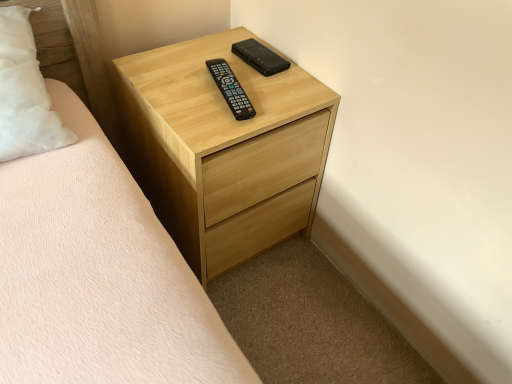
What do you see at coordinates (226, 149) in the screenshot? This screenshot has width=512, height=384. I see `light wood chest of drawers at center` at bounding box center [226, 149].

Identify the location of black plastic remote at center, placed as the second control when sorted from back to front. The image size is (512, 384). (231, 89).

Are black matte phone at upper center, the first control from the top, and light wood chest of drawers at center far apart?

No, black matte phone at upper center, the first control from the top, is not far away from light wood chest of drawers at center.

From the image's perspective, does black matte phone at upper center, the first control from the top, appear lower than light wood chest of drawers at center?

No, from the image's perspective, black matte phone at upper center, the first control from the top, is not beneath light wood chest of drawers at center.

Which is closer to the camera, (x=281, y=60) or (x=250, y=149)?

Point (x=281, y=60).

Between black plastic remote at center, the first control in the bottom-to-top sequence, and light wood chest of drawers at center, which one has more height?

light wood chest of drawers at center.

Between black plastic remote at center, the first control in the bottom-to-top sequence, and light wood chest of drawers at center, which one has smaller width?

With smaller width is black plastic remote at center, the first control in the bottom-to-top sequence.

Based on their sizes in the image, would you say black plastic remote at center, placed as the second control when sorted from back to front, is bigger or smaller than light wood chest of drawers at center?

Clearly, black plastic remote at center, placed as the second control when sorted from back to front, is smaller in size than light wood chest of drawers at center.

Is light wood chest of drawers at center closer to the viewer compared to black plastic remote at center, the 2th control positioned from the top?

Yes, the depth of light wood chest of drawers at center is less than that of black plastic remote at center, the 2th control positioned from the top.

Between light wood chest of drawers at center and black plastic remote at center, the 2th control positioned from the top, which one appears on the left side from the viewer's perspective?

From the viewer's perspective, light wood chest of drawers at center appears more on the left side.

Find the location of a particular element. Image resolution: width=512 pixels, height=384 pixels. chest of drawers on the left of black plastic remote at center, the 2th control positioned from the top is located at coordinates 226,149.

Could you tell me if light wood chest of drawers at center is turned towards black plastic remote at center, placed as the second control when sorted from back to front?

No, light wood chest of drawers at center does not turn towards black plastic remote at center, placed as the second control when sorted from back to front.

Considering the sizes of objects black plastic remote at center, the 2th control positioned from the top, and black matte phone at upper center, acting as the 1th control starting from the back, in the image provided, who is bigger, black plastic remote at center, the 2th control positioned from the top, or black matte phone at upper center, acting as the 1th control starting from the back,?

black plastic remote at center, the 2th control positioned from the top.

Are black plastic remote at center, the 2th control positioned from the top, and black matte phone at upper center, which is the 2th control in front-to-back order, making contact?

black plastic remote at center, the 2th control positioned from the top, and black matte phone at upper center, which is the 2th control in front-to-back order, are not in contact.

Would you say black plastic remote at center, the 2th control positioned from the top, is outside black matte phone at upper center, arranged as the second control when ordered from the bottom?

That's correct, black plastic remote at center, the 2th control positioned from the top, is outside of black matte phone at upper center, arranged as the second control when ordered from the bottom.

Which of these two, black plastic remote at center, the 2th control positioned from the top, or black matte phone at upper center, acting as the 1th control starting from the back, is wider?

black plastic remote at center, the 2th control positioned from the top.

Is black matte phone at upper center, the first control from the top, oriented towards black plastic remote at center, the first control from the front?

No, black matte phone at upper center, the first control from the top, is not facing towards black plastic remote at center, the first control from the front.

Is black matte phone at upper center, arranged as the second control when ordered from the bottom, to the left or to the right of black plastic remote at center, the 2th control positioned from the top, in the image?

Based on their positions, black matte phone at upper center, arranged as the second control when ordered from the bottom, is located to the right of black plastic remote at center, the 2th control positioned from the top.

Which is closer, (236,47) or (216,60)?

Point (236,47).

Between black matte phone at upper center, arranged as the second control when ordered from the bottom, and black plastic remote at center, the first control in the bottom-to-top sequence, which one has smaller size?

With smaller size is black matte phone at upper center, arranged as the second control when ordered from the bottom.

How far apart are light wood chest of drawers at center and black matte phone at upper center, acting as the 1th control starting from the back?

light wood chest of drawers at center is 10.61 inches away from black matte phone at upper center, acting as the 1th control starting from the back.

From the image's perspective, who appears lower, light wood chest of drawers at center or black matte phone at upper center, which is the 2th control in front-to-back order?

light wood chest of drawers at center.

Looking at the image, does light wood chest of drawers at center seem bigger or smaller compared to black matte phone at upper center, which is the 2th control in front-to-back order?

Considering their sizes, light wood chest of drawers at center takes up more space than black matte phone at upper center, which is the 2th control in front-to-back order.

Can you confirm if light wood chest of drawers at center is positioned to the left of black matte phone at upper center, which is the 2th control in front-to-back order?

Correct, you'll find light wood chest of drawers at center to the left of black matte phone at upper center, which is the 2th control in front-to-back order.

You are a GUI agent. You are given a task and a screenshot of the screen. Output one action in this format:
    pyautogui.click(x=<x>, y=<y>)
    Task: Click on the chest of drawers that is under the black matte phone at upper center, acting as the 1th control starting from the back (from a real-world perspective)
    
    Given the screenshot: What is the action you would take?
    point(226,149)

Locate an element on the screen. This screenshot has width=512, height=384. the 1st control counting from the right side of the light wood chest of drawers at center is located at coordinates (231, 89).

Estimate the real-world distances between objects in this image. Which object is closer to light wood chest of drawers at center, black plastic remote at center, the first control in the bottom-to-top sequence, or black matte phone at upper center, acting as the 1th control starting from the back?

Among the two, black plastic remote at center, the first control in the bottom-to-top sequence, is located nearer to light wood chest of drawers at center.

Based on the photo, estimate the real-world distances between objects in this image. Which object is further from black matte phone at upper center, acting as the 1th control starting from the back, light wood chest of drawers at center or black plastic remote at center, the 2th control positioned from the top?

light wood chest of drawers at center is further to black matte phone at upper center, acting as the 1th control starting from the back.

Which object lies further to the anchor point light wood chest of drawers at center, black matte phone at upper center, acting as the 1th control starting from the back, or black plastic remote at center, the first control in the bottom-to-top sequence?

black matte phone at upper center, acting as the 1th control starting from the back, is positioned further to the anchor light wood chest of drawers at center.

Looking at the image, which one is located closer to black plastic remote at center, placed as the second control when sorted from back to front, light wood chest of drawers at center or black matte phone at upper center, acting as the 1th control starting from the back?

Among the two, black matte phone at upper center, acting as the 1th control starting from the back, is located nearer to black plastic remote at center, placed as the second control when sorted from back to front.

Looking at the image, which one is located further to black plastic remote at center, the first control from the front, black matte phone at upper center, acting as the 1th control starting from the back, or light wood chest of drawers at center?

light wood chest of drawers at center.

Based on their spatial positions, is black plastic remote at center, the first control in the bottom-to-top sequence, or light wood chest of drawers at center closer to black matte phone at upper center, which is the 2th control in front-to-back order?

black plastic remote at center, the first control in the bottom-to-top sequence, lies closer to black matte phone at upper center, which is the 2th control in front-to-back order, than the other object.

This screenshot has height=384, width=512. I want to click on control between black matte phone at upper center, acting as the 1th control starting from the back, and light wood chest of drawers at center from top to bottom, so click(x=231, y=89).